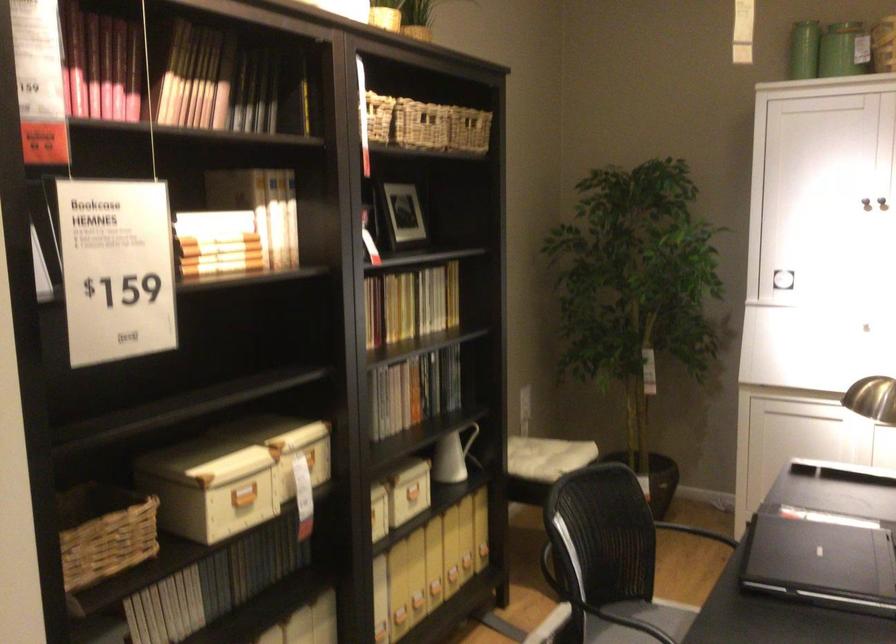
Where would you lift the white pitcher handle? Please return your answer as a coordinate pair (x, y).

(474, 444)